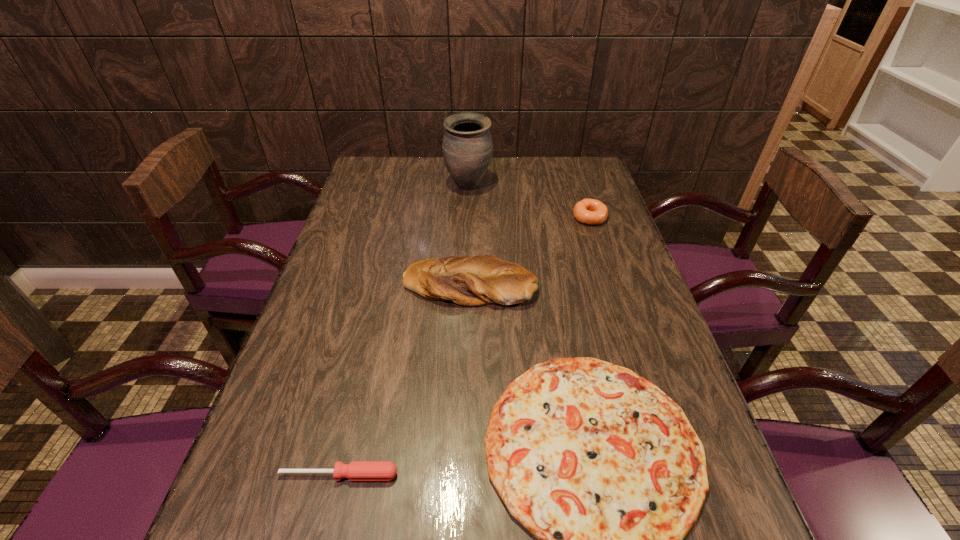
You are a GUI agent. You are given a task and a screenshot of the screen. Output one action in this format:
    pyautogui.click(x=<x>, y=<y>)
    Task: Click on the free point between the tallest object and the second shortest object
    The image size is (960, 540).
    Given the screenshot: What is the action you would take?
    pyautogui.click(x=404, y=330)

Identify the location of unoccupied position between the tallest object and the doughnut. This screenshot has height=540, width=960. (529, 201).

The width and height of the screenshot is (960, 540). I want to click on free space between the screwdriver and the fourth shortest object, so click(x=404, y=380).

Where is `free space that is in between the fourth nearest object and the fourth shortest object`? The height and width of the screenshot is (540, 960). free space that is in between the fourth nearest object and the fourth shortest object is located at coordinates (530, 251).

Find the location of `vacant space in between the fourth tallest object and the fourth shortest object`. vacant space in between the fourth tallest object and the fourth shortest object is located at coordinates (404, 380).

Locate which object is the fourth closest to the second tallest object. Please provide its 2D coordinates. Your answer should be formatted as a tuple, i.e. [(x, y)], where the tuple contains the x and y coordinates of a point satisfying the conditions above.

[(356, 470)]

Identify which object is located as the second nearest to the second tallest object. Please provide its 2D coordinates. Your answer should be formatted as a tuple, i.e. [(x, y)], where the tuple contains the x and y coordinates of a point satisfying the conditions above.

[(588, 211)]

This screenshot has height=540, width=960. In order to click on blank space that satisfies the following two spatial constraints: 1. on the back side of the screwdriver; 2. on the right side of the bread in this screenshot , I will do (x=384, y=285).

Locate an element on the screen. free space that satisfies the following two spatial constraints: 1. on the front side of the second farthest object; 2. on the right side of the farthest object is located at coordinates (468, 217).

The width and height of the screenshot is (960, 540). I want to click on vacant space that satisfies the following two spatial constraints: 1. on the back side of the second tallest object; 2. on the left side of the third shortest object, so click(x=471, y=217).